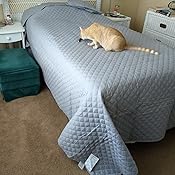
Find the location of a particular element. The image size is (175, 175). walls is located at coordinates (127, 10), (145, 4).